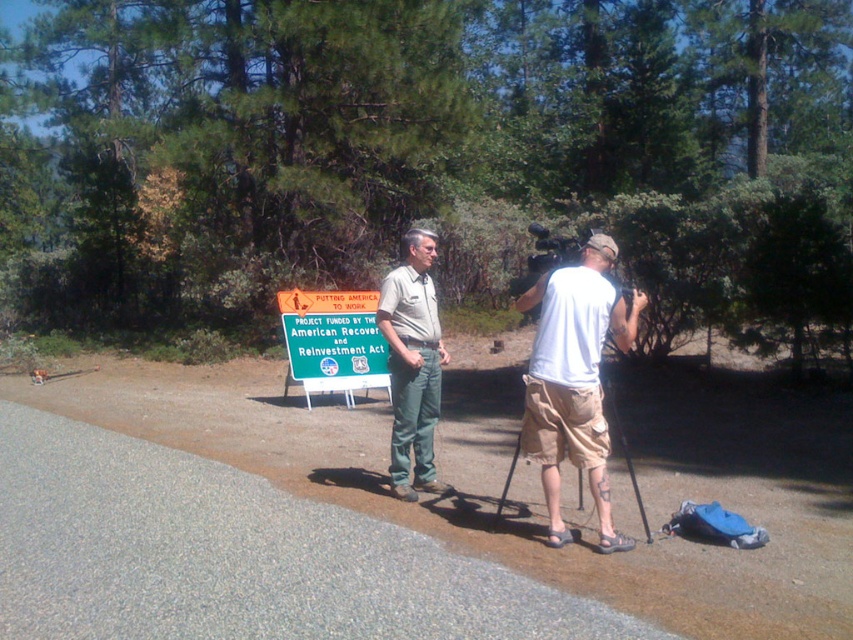
Question: Can you confirm if khaki uniform pants at center is positioned to the left of green matte sign at center?

Choices:
 (A) yes
 (B) no

Answer: (B)

Question: Which object is the closest to the green matte sign at center?

Choices:
 (A) black metal tripod at center
 (B) khaki uniform pants at center

Answer: (B)

Question: Which object is positioned closest to the black metal tripod at center?

Choices:
 (A) green matte sign at center
 (B) khaki uniform pants at center

Answer: (B)

Question: Can you confirm if khaki uniform pants at center is positioned below black metal tripod at center?

Choices:
 (A) no
 (B) yes

Answer: (A)

Question: Which point is closer to the camera?

Choices:
 (A) (633, 470)
 (B) (416, 448)

Answer: (B)

Question: Can you confirm if green matte sign at center is positioned to the right of black metal tripod at center?

Choices:
 (A) yes
 (B) no

Answer: (B)